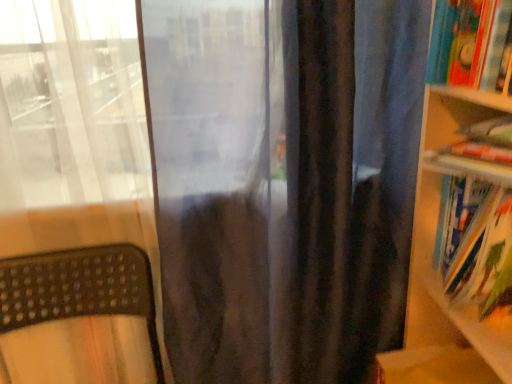
Question: Considering their positions, is hardcover book at right, which ranks as the 2th book in top-to-bottom order, located in front of or behind hardcover books at right?

Choices:
 (A) behind
 (B) front

Answer: (A)

Question: From a real-world perspective, is hardcover book at right, which ranks as the 2th book in top-to-bottom order, above or below hardcover books at right?

Choices:
 (A) below
 (B) above

Answer: (A)

Question: Which of these objects is positioned farthest from the hardcover book at upper right, which ranks as the 2th book in bottom-to-top order?

Choices:
 (A) hardcover books at right
 (B) brown textured mat at lower left
 (C) hardcover book at right, arranged as the first book when ordered from the bottom

Answer: (B)

Question: Which of these objects is positioned farthest from the hardcover book at right, arranged as the first book when ordered from the bottom?

Choices:
 (A) brown textured mat at lower left
 (B) hardcover book at upper right, which ranks as the 2th book in bottom-to-top order
 (C) hardcover books at right

Answer: (A)